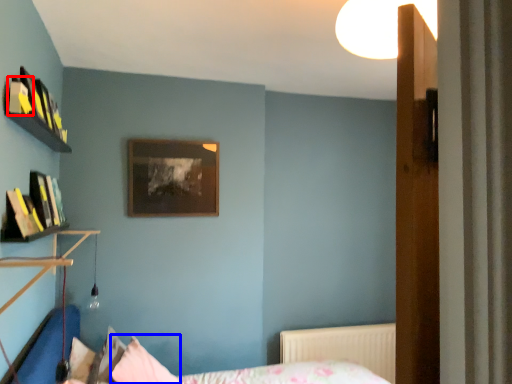
Question: Which of the following is the closest to the observer, book (highlighted by a red box) or pillow (highlighted by a blue box)?

Choices:
 (A) book
 (B) pillow

Answer: (A)